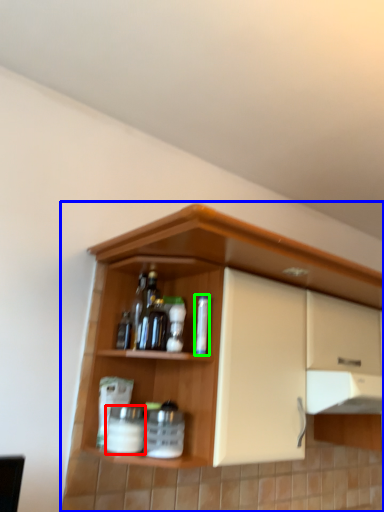
Question: Which is farther away from beverage (highlighted by a red box)? cupboard (highlighted by a blue box) or bottle (highlighted by a green box)?

Choices:
 (A) cupboard
 (B) bottle

Answer: (A)